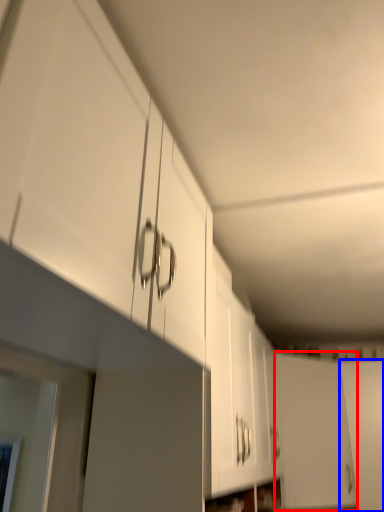
Question: Which object is closer to the camera taking this photo, door (highlighted by a red box) or door (highlighted by a blue box)?

Choices:
 (A) door
 (B) door

Answer: (A)